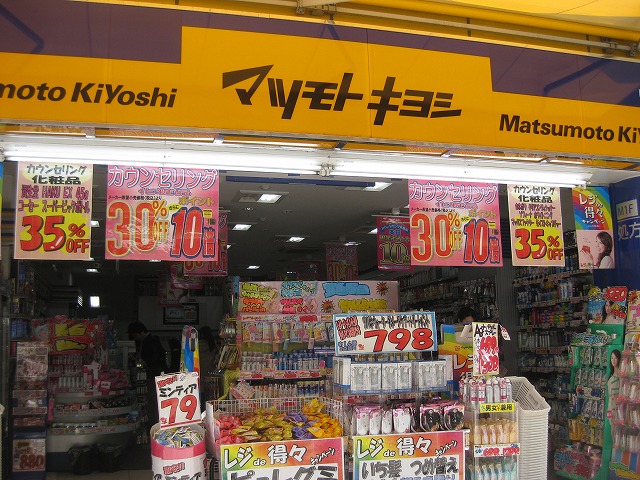
At what (x,y) coordinates should I click in order to perform the action: click on ceiling. Please return your answer as a coordinate pair (x, y). This screenshot has width=640, height=480. Looking at the image, I should click on click(316, 203).